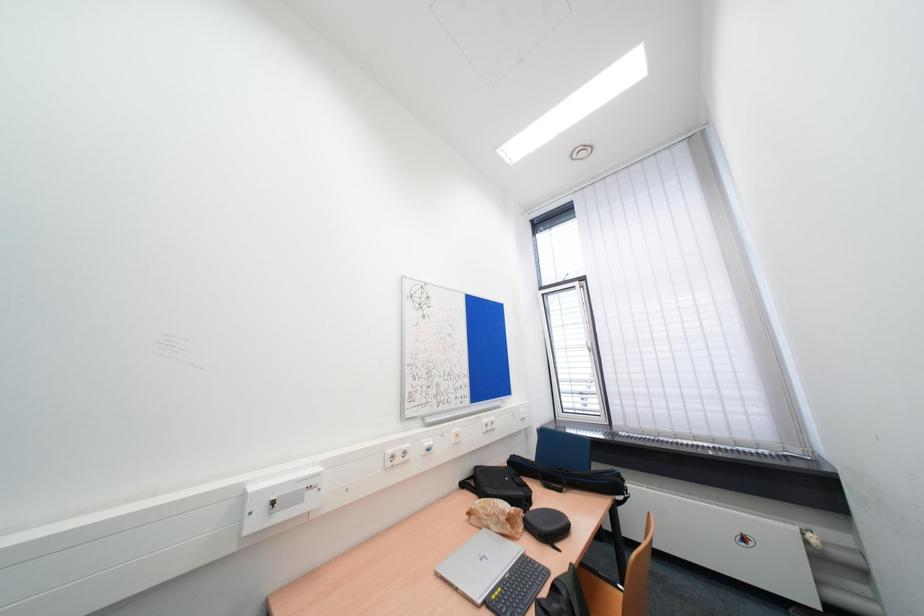
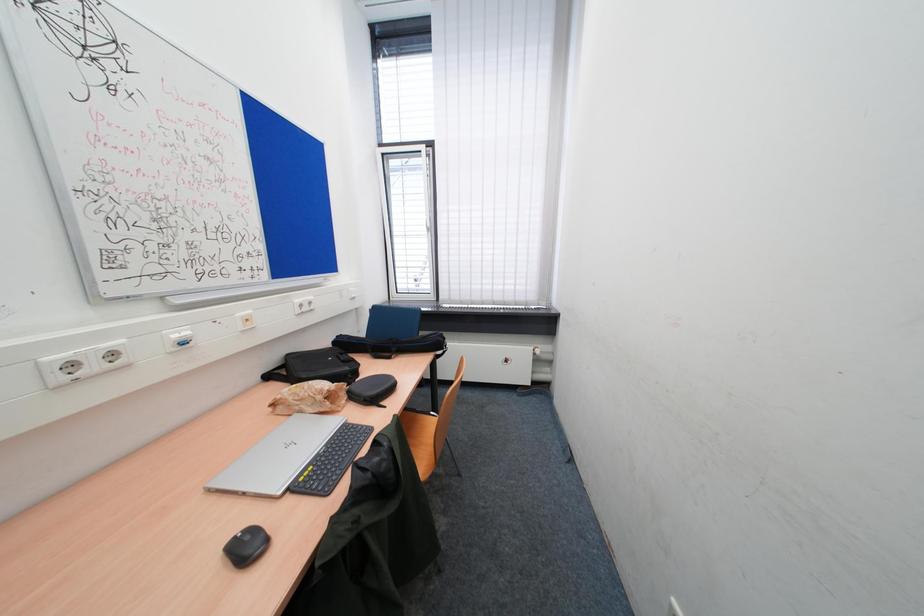
From the picture: First-person continuous shooting, in which direction is the camera rotating?

The rotation direction of the camera is right-down.